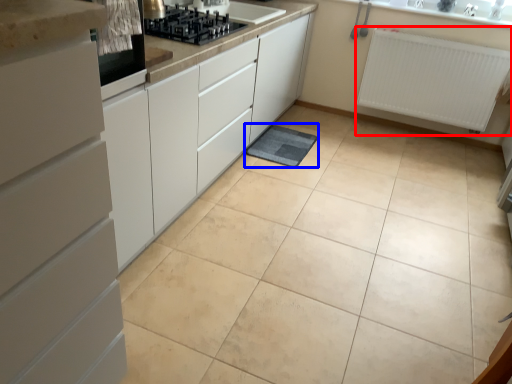
Question: Among these objects, which one is farthest to the camera, radiator (highlighted by a red box) or bath mat (highlighted by a blue box)?

Choices:
 (A) radiator
 (B) bath mat

Answer: (A)